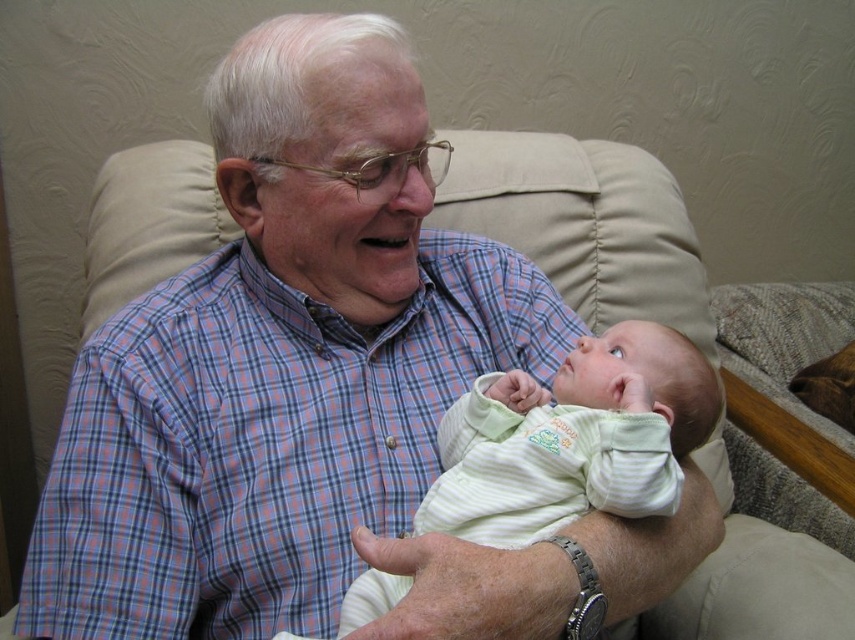
Question: Can you confirm if plaid cotton shirt at center is positioned to the left of light green striped fabric baby at center?

Choices:
 (A) yes
 (B) no

Answer: (A)

Question: Which of the following is the farthest from the observer?

Choices:
 (A) [x=605, y=451]
 (B) [x=213, y=486]

Answer: (B)

Question: Can you confirm if plaid cotton shirt at center is bigger than light green striped fabric baby at center?

Choices:
 (A) no
 (B) yes

Answer: (B)

Question: Considering the relative positions of plaid cotton shirt at center and light green striped fabric baby at center in the image provided, where is plaid cotton shirt at center located with respect to light green striped fabric baby at center?

Choices:
 (A) above
 (B) below

Answer: (A)

Question: Which point is closer to the camera?

Choices:
 (A) plaid cotton shirt at center
 (B) light green striped fabric baby at center

Answer: (B)